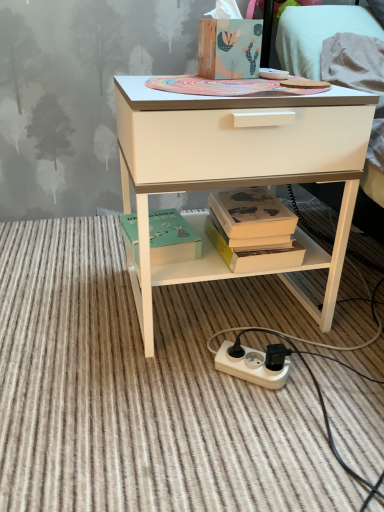
I want to click on vacant area to the right of white plastic power outlet at lower center, so [x=329, y=375].